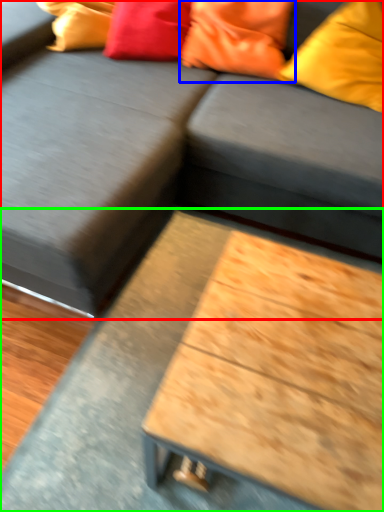
Question: Which is farther away from studio couch (highlighted by a red box)? pillow (highlighted by a blue box) or table (highlighted by a green box)?

Choices:
 (A) pillow
 (B) table

Answer: (A)